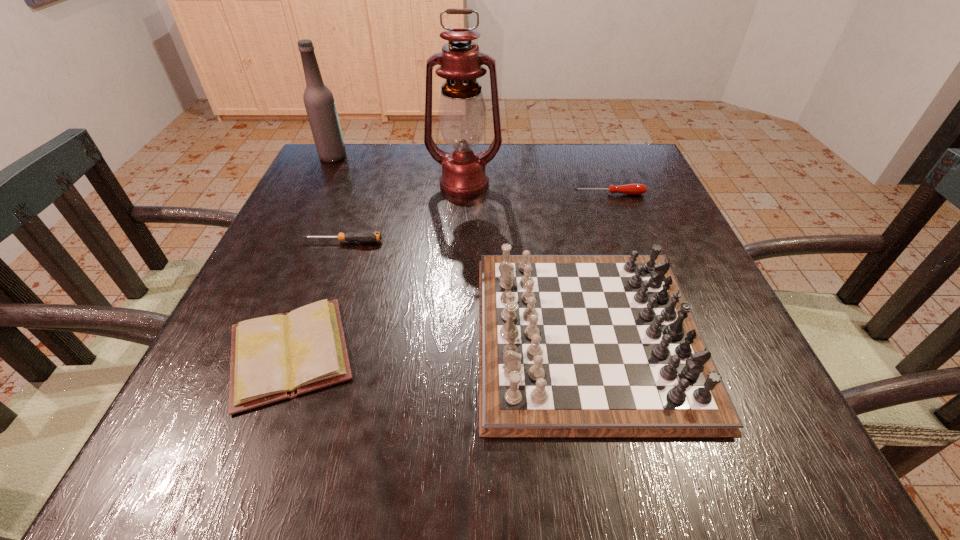
At what (x,y) coordinates should I click in order to perform the action: click on diary at the near edge. Please return your answer as a coordinate pair (x, y). The width and height of the screenshot is (960, 540). Looking at the image, I should click on (275, 357).

Find the location of a particular element. The height and width of the screenshot is (540, 960). beer bottle positioned at the left edge is located at coordinates (319, 102).

What are the coordinates of `screwdriver that is positioned at the left edge` in the screenshot? It's located at (363, 236).

Where is `diary that is positioned at the left edge`? diary that is positioned at the left edge is located at coordinates (275, 357).

Find the location of `chessboard that is at the right edge`. chessboard that is at the right edge is located at coordinates (569, 345).

I want to click on screwdriver positioned at the right edge, so click(632, 189).

This screenshot has height=540, width=960. In order to click on object located in the far left corner section of the desktop in this screenshot , I will do `click(319, 102)`.

Locate an element on the screen. object present at the near left corner is located at coordinates (275, 357).

At what (x,y) coordinates should I click in order to perform the action: click on object that is positioned at the far right corner. Please return your answer as a coordinate pair (x, y). This screenshot has width=960, height=540. Looking at the image, I should click on (632, 189).

Locate an element on the screen. This screenshot has width=960, height=540. object that is at the near right corner is located at coordinates (569, 345).